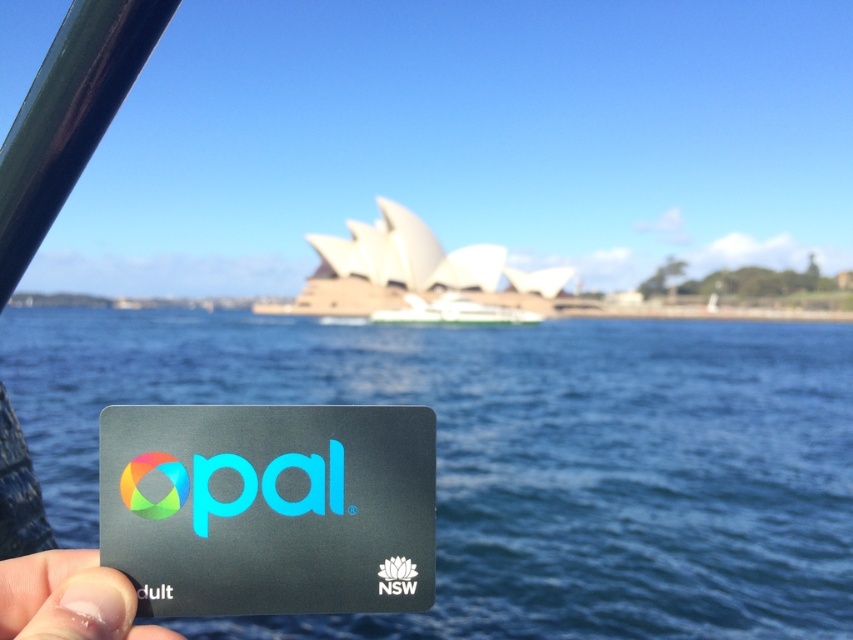
Question: Which point is farther to the camera?

Choices:
 (A) (402, 618)
 (B) (404, 577)
 (C) (126, 470)
 (D) (444, 310)

Answer: (D)

Question: Is transparent water at center smaller than red matte nsw logo at lower center?

Choices:
 (A) yes
 (B) no

Answer: (B)

Question: Which of these objects is positioned farthest from the black matte opal card at lower left?

Choices:
 (A) transparent water at center
 (B) red matte nsw logo at lower center
 (C) finger nail at lower left

Answer: (A)

Question: Does finger nail at lower left appear over red matte nsw logo at lower center?

Choices:
 (A) no
 (B) yes

Answer: (A)

Question: Is black matte opal card at lower left thinner than white matte boat at center?

Choices:
 (A) yes
 (B) no

Answer: (A)

Question: Which point appears closest to the camera in this image?

Choices:
 (A) (496, 624)
 (B) (432, 310)

Answer: (A)